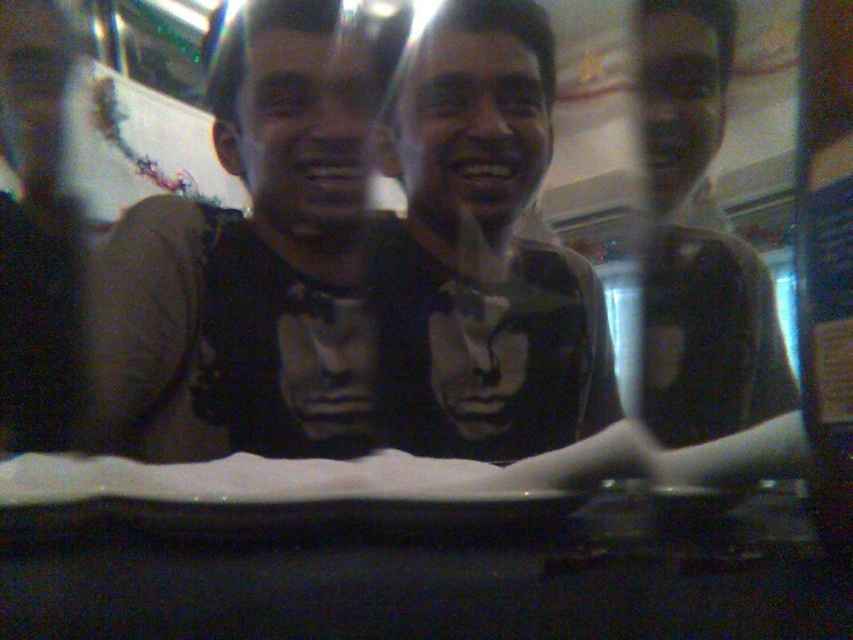
You are a photographer trying to focus on the matte black bow tie at center in the image. The camera has a focus grid that can only target coordinates between 0.3 and 0.4 on the X and Y axes. Is the bow tie within the focus range?

The position of matte black bow tie at center is at point (254, 253). The X coordinate is within the 0.3 to 0.4 range, but the Y coordinate is 0.299, which is just below the minimum Y threshold of 0.3. Therefore, the bow tie is slightly outside the focus range.